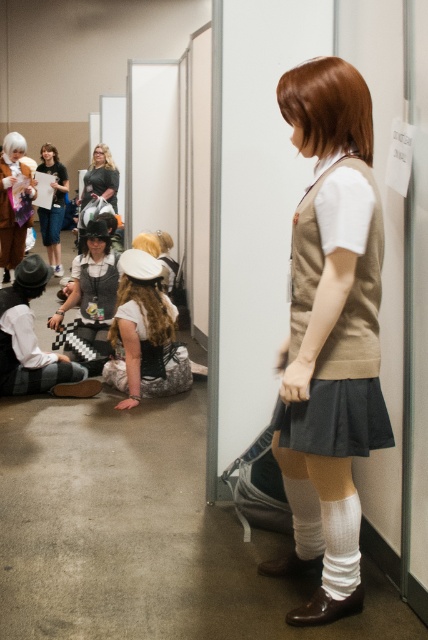
You are organizing a cosplay event and need to arrange the items in the dressing room. The matte black hat at lower left and the matte brown coat at left are both on a rack. Which item is closer to the floor?

The matte black hat at lower left is positioned under the matte brown coat at left, so it is closer to the floor.

You are standing at point (82, 264) and want to move to point (127, 346). Is the path directly in front of you clear?

Yes, the path is clear because point (127, 346) is in front of point (82, 264).

From the picture: You are standing in the dressing room and need to place a new accessory at the exact same position as the matte black hat at lower left. What are the coordinates where you should place it?

The coordinates for the matte black hat at lower left are at point (27,353). You should place the new accessory at those coordinates.